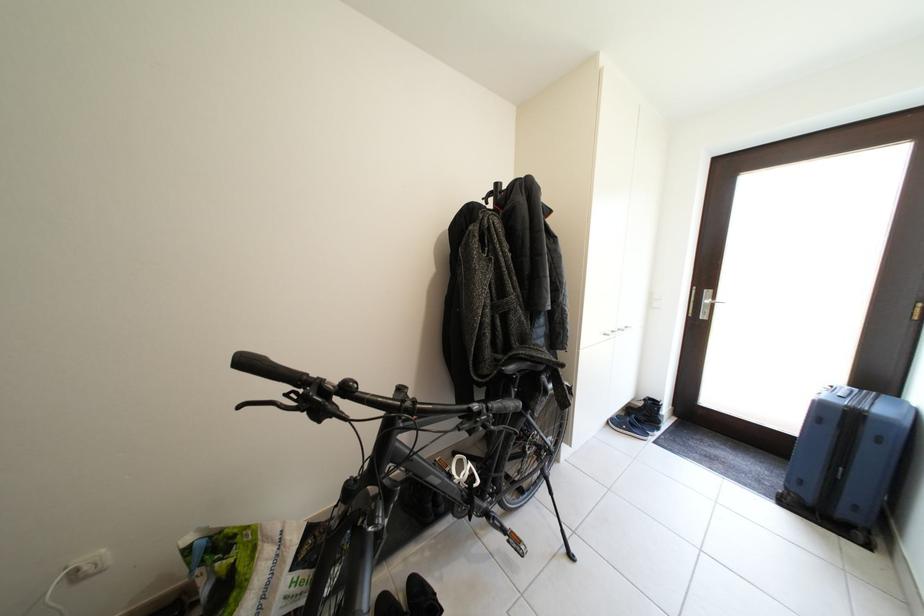
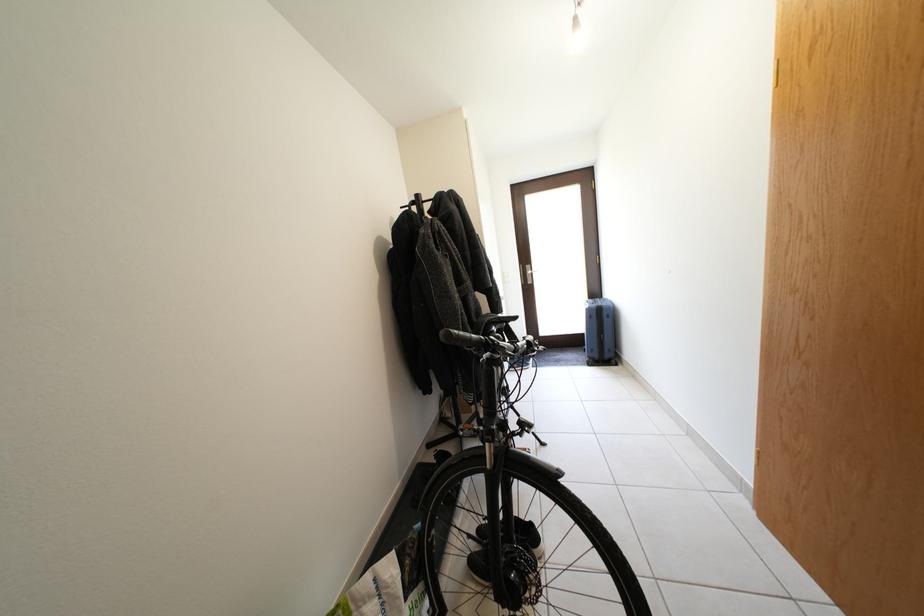
Question: How did the camera likely rotate?

Choices:
 (A) Left
 (B) Right
 (C) Up
 (D) Down

Answer: (B)